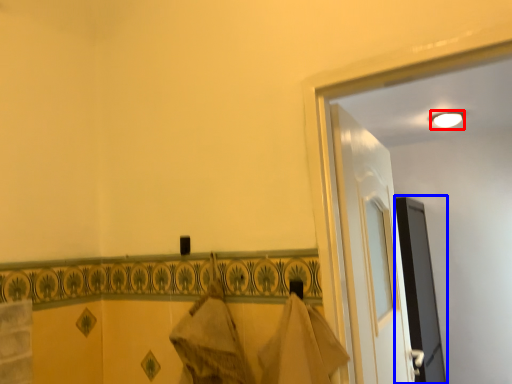
Question: Which object appears farthest to the camera in this image, light (highlighted by a red box) or screen door (highlighted by a blue box)?

Choices:
 (A) light
 (B) screen door

Answer: (A)